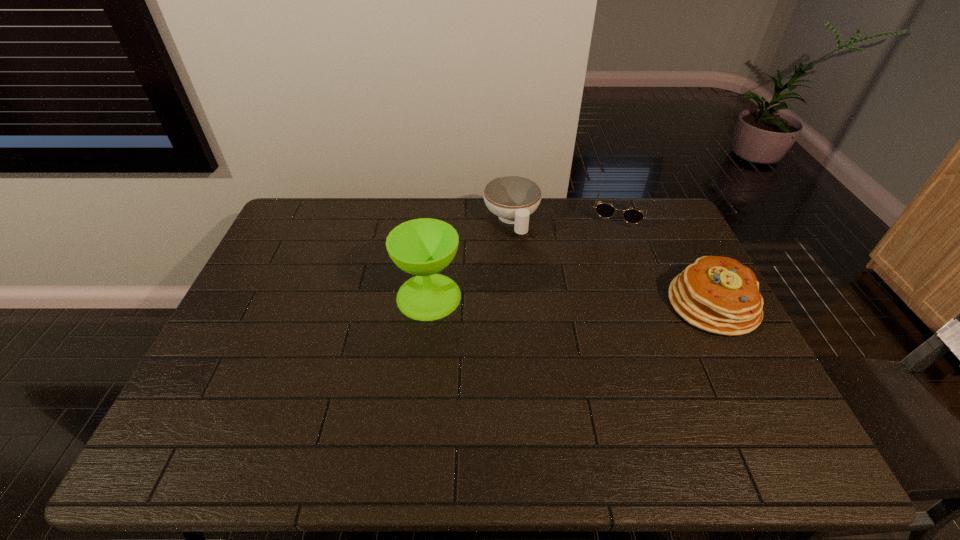
The width and height of the screenshot is (960, 540). Find the location of `the leftmost object`. the leftmost object is located at coordinates (423, 247).

Find the location of a particular element. This screenshot has height=540, width=960. the tallest object is located at coordinates (423, 247).

This screenshot has width=960, height=540. I want to click on pancake, so click(x=718, y=294).

Where is `sunglasses`? This screenshot has height=540, width=960. sunglasses is located at coordinates (633, 216).

Find the location of a particular element. The image size is (960, 540). the third tallest object is located at coordinates (512, 198).

Image resolution: width=960 pixels, height=540 pixels. In order to click on chinaware in this screenshot , I will do `click(512, 198)`.

Image resolution: width=960 pixels, height=540 pixels. I want to click on vacant region located 0.390m on the left of the tallest object, so click(265, 296).

Locate an element on the screen. This screenshot has width=960, height=540. vacant space located on the left of the pancake is located at coordinates (576, 305).

Find the location of `free region located 0.050m on the front lenses of the shortest object`. free region located 0.050m on the front lenses of the shortest object is located at coordinates (612, 239).

The width and height of the screenshot is (960, 540). In order to click on free point located 0.140m on the front lenses of the shortest object in this screenshot , I will do `click(607, 255)`.